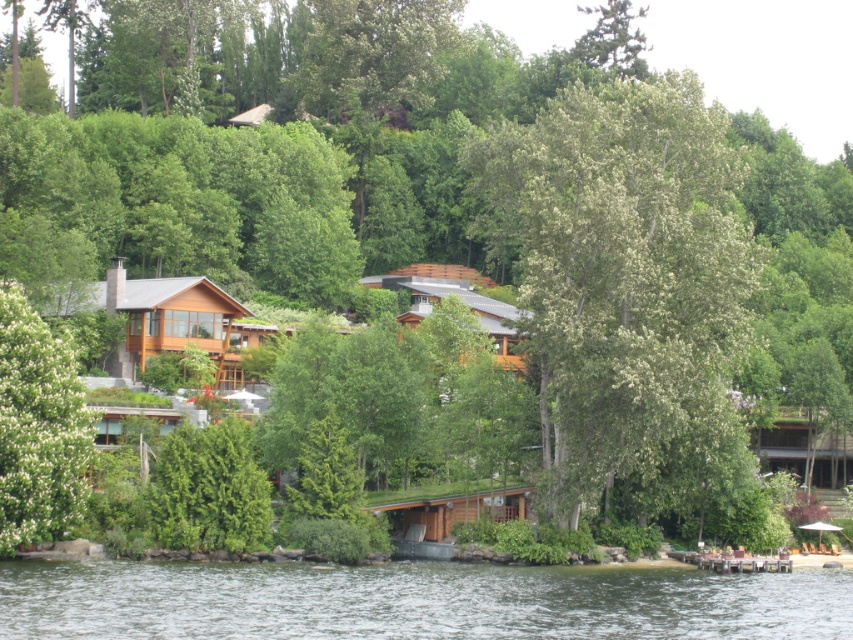
Question: Does green leafy tree at left appear over green textured tree at center?

Choices:
 (A) yes
 (B) no

Answer: (A)

Question: Which object is closer to the camera taking this photo?

Choices:
 (A) brown wooden hut at lower right
 (B) green textured tree at center
 (C) green leafy tree at center

Answer: (C)

Question: Considering the real-world distances, which object is closest to the green textured tree at center?

Choices:
 (A) brown wooden hut at lower right
 (B) green leafy tree at left
 (C) dark blue water at lower left
 (D) green leafy tree at center

Answer: (B)

Question: Can you confirm if green textured tree at center is smaller than brown wooden hut at lower right?

Choices:
 (A) no
 (B) yes

Answer: (B)

Question: Can you confirm if green textured tree at center is smaller than brown wooden hut at lower right?

Choices:
 (A) no
 (B) yes

Answer: (B)

Question: Which object is the farthest from the dark blue water at lower left?

Choices:
 (A) green textured tree at center
 (B) green leafy tree at center

Answer: (A)